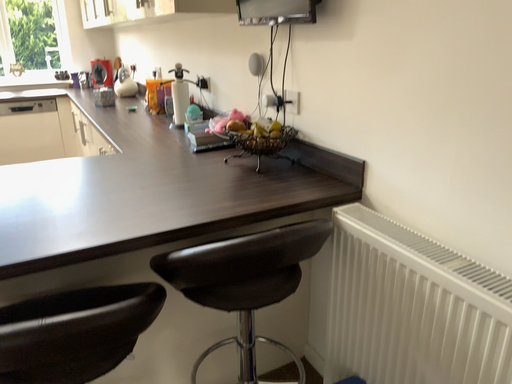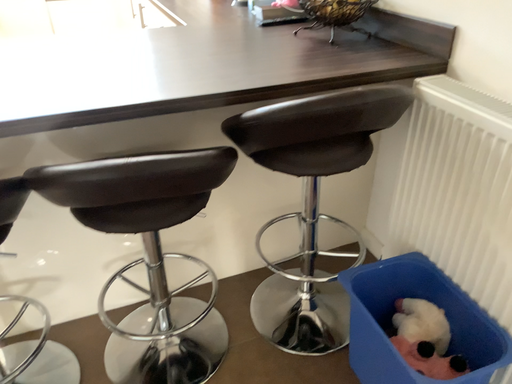
Question: How did the camera likely rotate when shooting the video?

Choices:
 (A) rotated downward
 (B) rotated upward

Answer: (A)